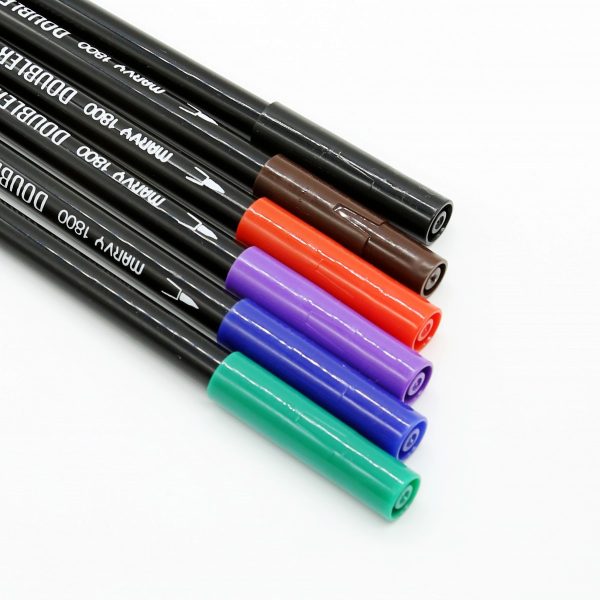
Identify the location of marker caps. (340, 445), (348, 404), (357, 338), (367, 300), (380, 255), (396, 205).